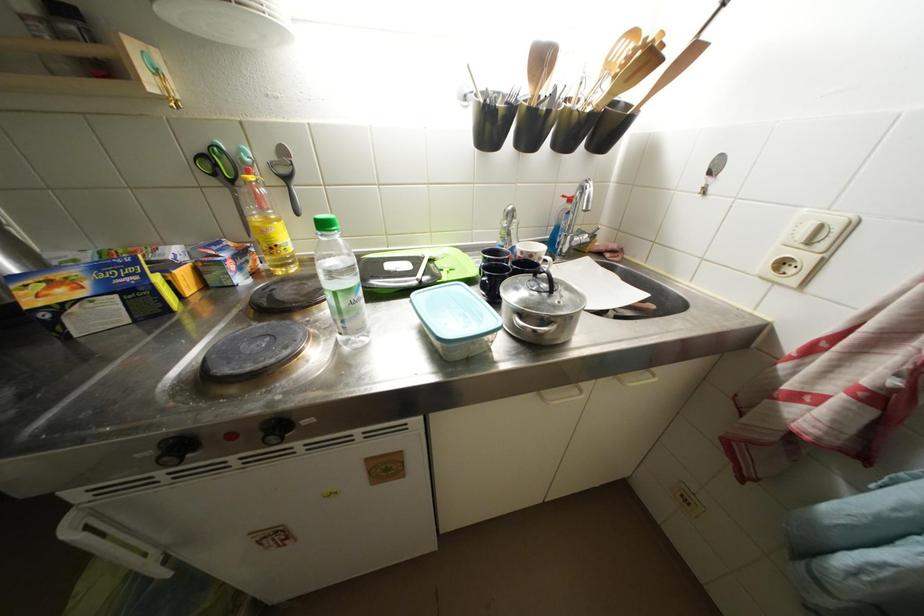
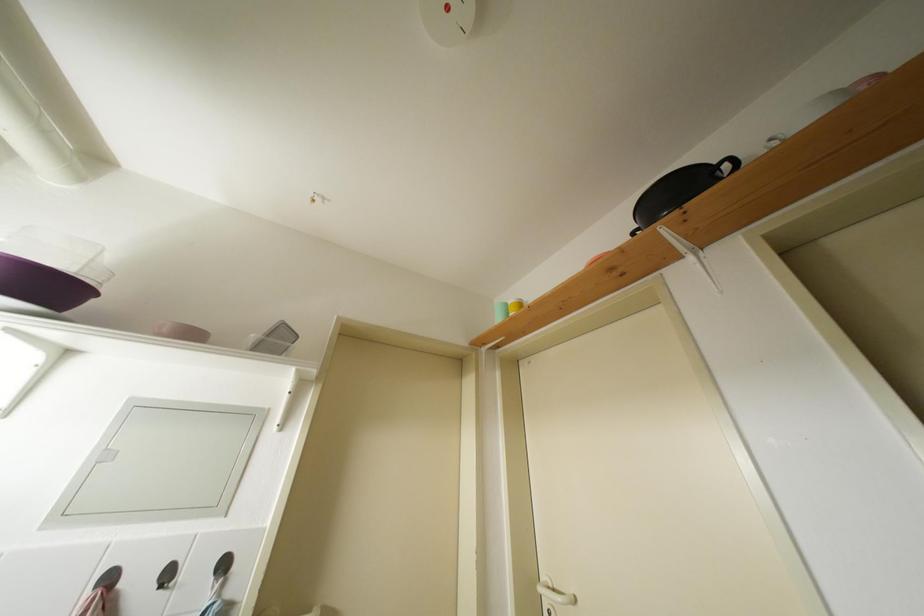
Based on the photo, the first image is from the beginning of the video and the second image is from the end. How did the camera likely rotate when shooting the video?

The rotation direction of the camera is right-up.